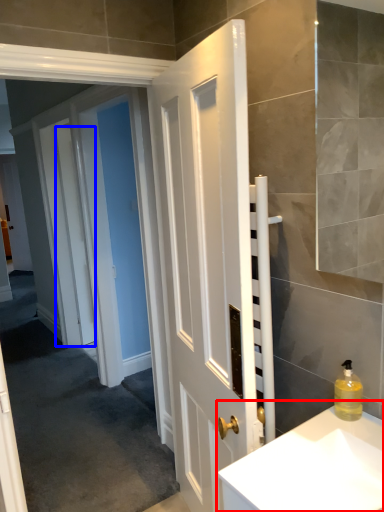
Question: Among these objects, which one is nearest to the camera, sink (highlighted by a red box) or door (highlighted by a blue box)?

Choices:
 (A) sink
 (B) door

Answer: (A)